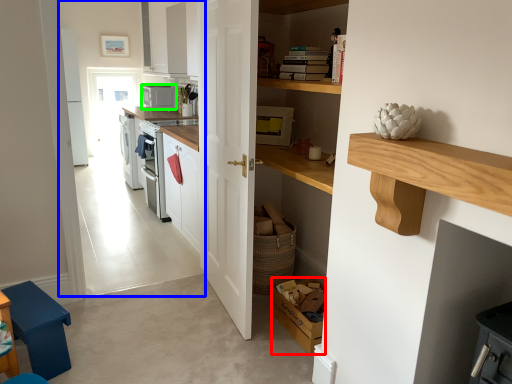
Question: Which object is positioned farthest from box (highlighted by a red box)? Select from corridor (highlighted by a blue box) and appliance (highlighted by a green box).

Choices:
 (A) corridor
 (B) appliance

Answer: (A)